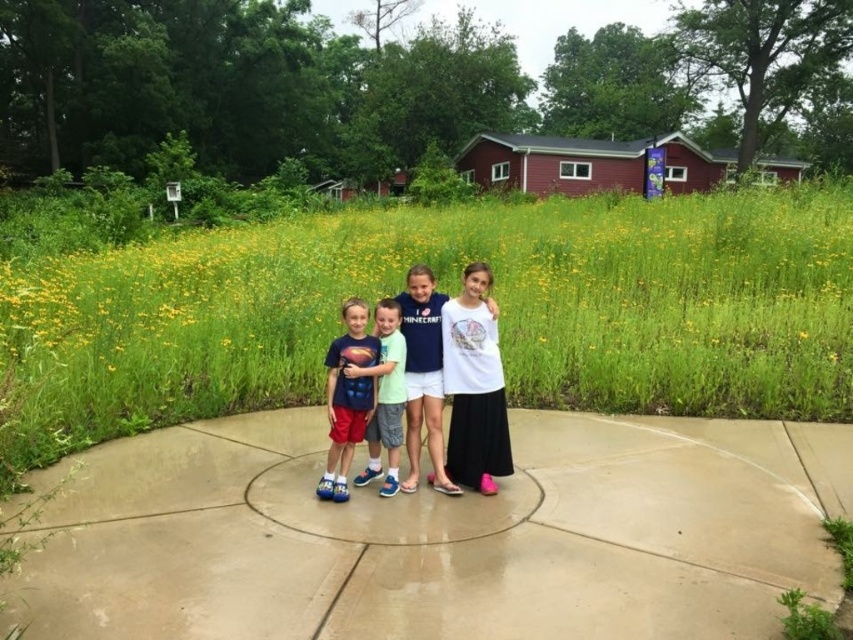
You are a parent trying to ensure your child stays within a safe distance from the edge of the concrete platform. The edge is marked by the smooth concrete pavement at center. Your child is wearing the white matte shirt at center. Based on the distance provided, is your child within a 24 inch safety zone from the edge?

The distance between the smooth concrete pavement at center and the white matte shirt at center is 31.39 inches. Since 31.39 inches is greater than 24 inches, the child is outside the safety zone and needs to move closer to the edge to stay within the 24 inch limit.

You are a parent trying to locate your child wearing matte blue shorts at center in the image. The child is standing on the smooth concrete pavement at center. Based on the scene description, where would you find the child relative to the pavement?

The smooth concrete pavement at center is positioned on the right side of matte blue shorts at center, so the child wearing matte blue shorts at center is standing to the left of the smooth concrete pavement at center.